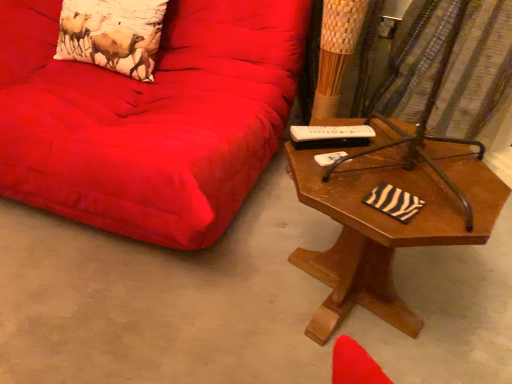
This screenshot has height=384, width=512. What do you see at coordinates (426, 126) in the screenshot?
I see `brown metal swivel chair at right` at bounding box center [426, 126].

What do you see at coordinates (387, 226) in the screenshot? I see `brown wooden table at right` at bounding box center [387, 226].

You are a GUI agent. You are given a task and a screenshot of the screen. Output one action in this format:
    pyautogui.click(x=<x>, y=<y>)
    Task: Click on the printed fabric pillow at upper left
    
    Given the screenshot: What is the action you would take?
    pyautogui.click(x=112, y=34)

Identify the location of suede red couch at upper left. (150, 118).

The image size is (512, 384). Find the location of `brown metal swivel chair at right`. brown metal swivel chair at right is located at coordinates (426, 126).

Is suede red couch at upper left positioned beyond the bounds of brown wooden table at right?

Yes, suede red couch at upper left is not within brown wooden table at right.

From a real-world perspective, is suede red couch at upper left on top of brown wooden table at right?

Yes, from a real-world perspective, suede red couch at upper left is over brown wooden table at right

In terms of height, does suede red couch at upper left look taller or shorter compared to brown wooden table at right?

In the image, suede red couch at upper left appears to be taller than brown wooden table at right.

Based on the photo, which of these two, suede red couch at upper left or brown wooden table at right, is bigger?

suede red couch at upper left is bigger.

Is brown wooden table at right placed right next to printed fabric pillow at upper left?

No.

Does point (379, 328) appear closer or farther from the camera than point (141, 75)?

Point (379, 328) appears to be closer to the viewer than point (141, 75).

At what (x,y) coordinates should I click in order to perform the action: click on pillow that appears behind the brown wooden table at right. Please return your answer as a coordinate pair (x, y). This screenshot has width=512, height=384. Looking at the image, I should click on (112, 34).

From the image's perspective, who appears lower, brown wooden table at right or printed fabric pillow at upper left?

From the image's view, brown wooden table at right is below.

The height and width of the screenshot is (384, 512). What are the coordinates of `pillow above the brown wooden table at right (from a real-world perspective)` in the screenshot? It's located at (112, 34).

Is printed fabric pillow at upper left far from brown wooden table at right?

Absolutely, printed fabric pillow at upper left is distant from brown wooden table at right.

Which point is more distant from viewer, (145,5) or (444,170)?

The point (145,5) is more distant.

From the image's perspective, does printed fabric pillow at upper left appear lower than brown wooden table at right?

No, from the image's perspective, printed fabric pillow at upper left is not beneath brown wooden table at right.

Is suede red couch at upper left placed right next to brown wooden table at right?

No, suede red couch at upper left is not with brown wooden table at right.

Is the depth of suede red couch at upper left less than that of brown wooden table at right?

Yes, the depth of suede red couch at upper left is less than that of brown wooden table at right.

From the image's perspective, is suede red couch at upper left on brown wooden table at right?

Yes, from the image's perspective, suede red couch at upper left is over brown wooden table at right.

You are a GUI agent. You are given a task and a screenshot of the screen. Output one action in this format:
    pyautogui.click(x=<x>, y=<y>)
    Task: Click on the swivel chair lying in front of the printed fabric pillow at upper left
    
    Given the screenshot: What is the action you would take?
    pyautogui.click(x=426, y=126)

From the picture: From a real-world perspective, who is located lower, printed fabric pillow at upper left or brown metal swivel chair at right?

brown metal swivel chair at right.

From the picture: Between printed fabric pillow at upper left and brown metal swivel chair at right, which one has smaller size?

Smaller between the two is printed fabric pillow at upper left.

Is printed fabric pillow at upper left further to the viewer compared to brown metal swivel chair at right?

Yes, it is behind brown metal swivel chair at right.

Is brown wooden table at right at the left side of brown metal swivel chair at right?

Yes, brown wooden table at right is to the left of brown metal swivel chair at right.

Which is in front, point (297, 259) or point (407, 148)?

Point (407, 148)

Are brown wooden table at right and brown metal swivel chair at right far apart?

Actually, brown wooden table at right and brown metal swivel chair at right are a little close together.

Is brown wooden table at right completely or partially inside brown metal swivel chair at right?

No, brown metal swivel chair at right does not contain brown wooden table at right.

Considering the sizes of objects brown metal swivel chair at right and brown wooden table at right in the image provided, who is wider, brown metal swivel chair at right or brown wooden table at right?

brown wooden table at right.

Between brown metal swivel chair at right and brown wooden table at right, which one is positioned behind?

brown metal swivel chair at right is more distant.

Is brown metal swivel chair at right oriented away from brown wooden table at right?

brown metal swivel chair at right does not have its back to brown wooden table at right.

At what (x,y) coordinates should I click in order to perform the action: click on studio couch above the brown wooden table at right (from the image's perspective). Please return your answer as a coordinate pair (x, y). The image size is (512, 384). Looking at the image, I should click on (150, 118).

The image size is (512, 384). Identify the location of concrete in front of the printed fabric pillow at upper left. (163, 299).

Which object lies further to the anchor point brown metal swivel chair at right, brown wooden table at right or brown wooden table at right?

brown wooden table at right.

Which object lies further to the anchor point suede red couch at upper left, brown wooden table at right or brown wooden table at right?

Among the two, brown wooden table at right is located further to suede red couch at upper left.

Based on their spatial positions, is brown wooden table at right or suede red couch at upper left further from printed fabric pillow at upper left?

Among the two, brown wooden table at right is located further to printed fabric pillow at upper left.

From the image, which object appears to be nearer to brown wooden table at right, brown wooden table at right or suede red couch at upper left?

suede red couch at upper left lies closer to brown wooden table at right than the other object.

Looking at the image, which one is located further to brown metal swivel chair at right, suede red couch at upper left or brown wooden table at right?

Based on the image, suede red couch at upper left appears to be further to brown metal swivel chair at right.

When comparing their distances from brown wooden table at right, does suede red couch at upper left or brown wooden table at right seem further?

Among the two, brown wooden table at right is located further to brown wooden table at right.

Considering their positions, is suede red couch at upper left positioned closer to printed fabric pillow at upper left than brown wooden table at right?

suede red couch at upper left is closer to printed fabric pillow at upper left.

From the image, which object appears to be nearer to printed fabric pillow at upper left, suede red couch at upper left or brown wooden table at right?

suede red couch at upper left is closer to printed fabric pillow at upper left.

I want to click on concrete between suede red couch at upper left and printed fabric pillow at upper left from front to back, so click(x=163, y=299).

This screenshot has width=512, height=384. I want to click on pillow situated between suede red couch at upper left and brown metal swivel chair at right from left to right, so click(x=112, y=34).

The height and width of the screenshot is (384, 512). I want to click on concrete between suede red couch at upper left and brown wooden table at right, so [163, 299].

Image resolution: width=512 pixels, height=384 pixels. Identify the location of table situated between suede red couch at upper left and brown metal swivel chair at right from left to right. (387, 226).